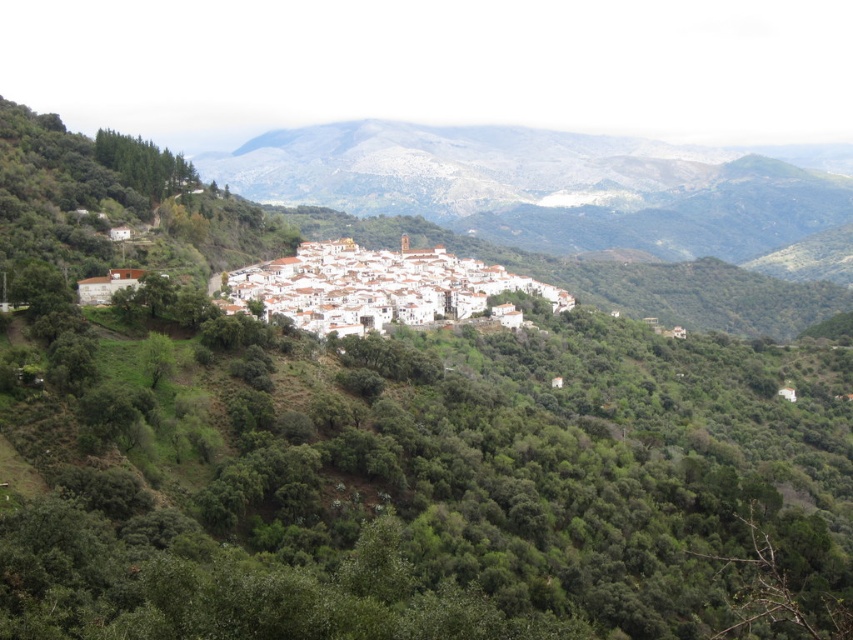
Question: Which point is closer to the camera?

Choices:
 (A) (846, 157)
 (B) (347, 330)

Answer: (B)

Question: Which point appears closest to the camera in this image?

Choices:
 (A) (531, 284)
 (B) (705, 164)

Answer: (A)

Question: Does green leafy mountain at center lie behind white matte buildings at center?

Choices:
 (A) yes
 (B) no

Answer: (A)

Question: Can you confirm if green leafy mountain at center is wider than white matte buildings at center?

Choices:
 (A) yes
 (B) no

Answer: (A)

Question: Which of the following is the closest to the observer?

Choices:
 (A) white matte buildings at center
 (B) green leafy mountain at center

Answer: (A)

Question: Is green leafy mountain at center closer to camera compared to white matte buildings at center?

Choices:
 (A) no
 (B) yes

Answer: (A)